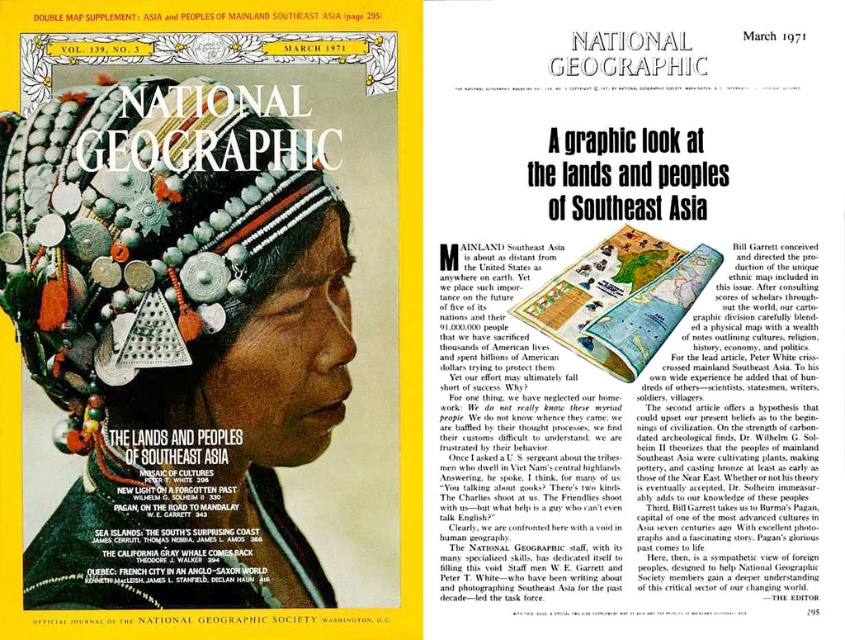
You are observing the National Geographic cover from March 1971. You notice two points marked on the image at coordinates point (150, 323) and point (565, 284). Which of these points is nearer to your viewpoint?

Point (150, 323) is closer to the camera than point (565, 284).

Looking at this image, what object is located at the point with coordinates (137, 228) on the image?

The point at coordinates (137, 228) corresponds to silver metallic beads and triangles at center.